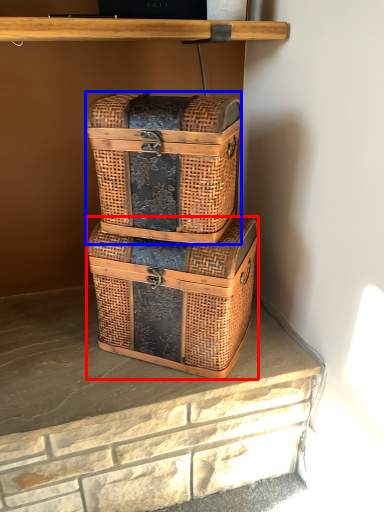
Question: Which object is further to the camera taking this photo, box (highlighted by a red box) or box (highlighted by a blue box)?

Choices:
 (A) box
 (B) box

Answer: (A)